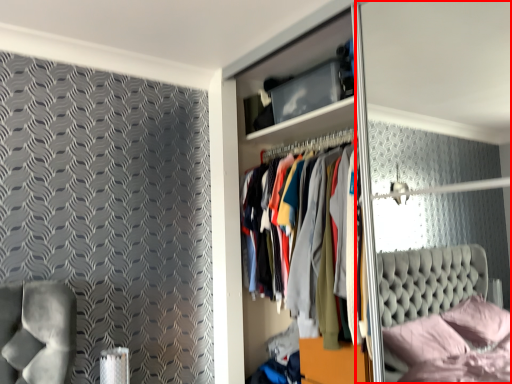
Question: From the image's perspective, where is glass door (annotated by the red box) located in relation to dresser in the image?

Choices:
 (A) below
 (B) above

Answer: (A)